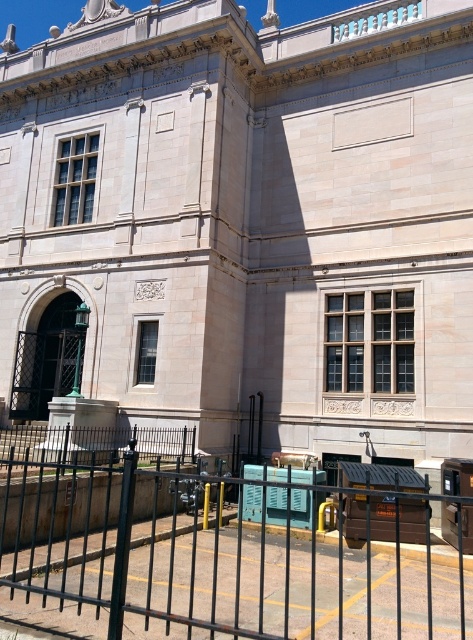
Question: Can you confirm if black metal fence at lower center is thinner than white marble clock at center?

Choices:
 (A) yes
 (B) no

Answer: (B)

Question: Which point is closer to the camera taking this photo?

Choices:
 (A) (346, 548)
 (B) (160, 291)

Answer: (A)

Question: Which of the following is the farthest from the observer?

Choices:
 (A) white marble clock at center
 (B) black metal fence at lower center

Answer: (A)

Question: Can you confirm if black metal fence at lower center is positioned above white marble clock at center?

Choices:
 (A) yes
 (B) no

Answer: (B)

Question: Does black metal fence at lower center have a greater width compared to white marble clock at center?

Choices:
 (A) no
 (B) yes

Answer: (B)